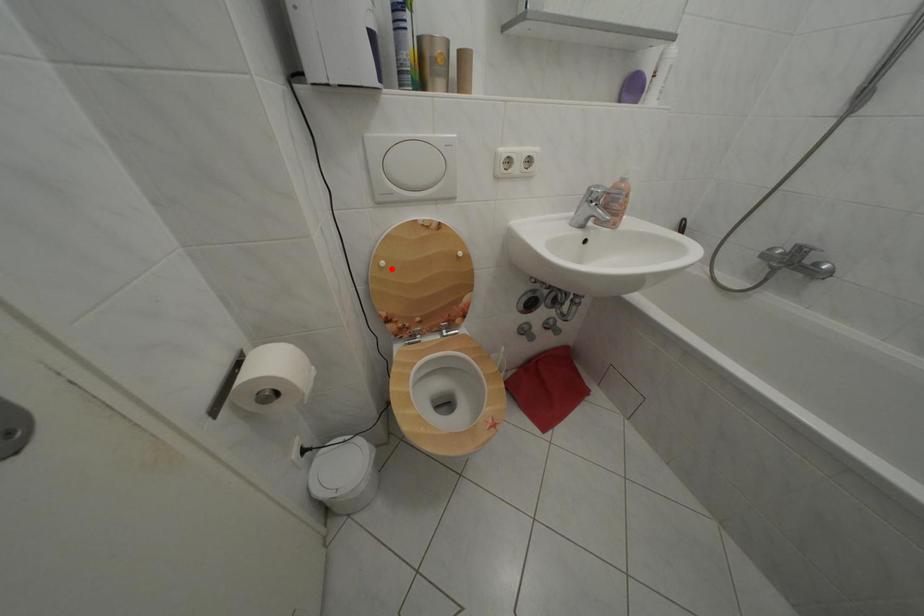
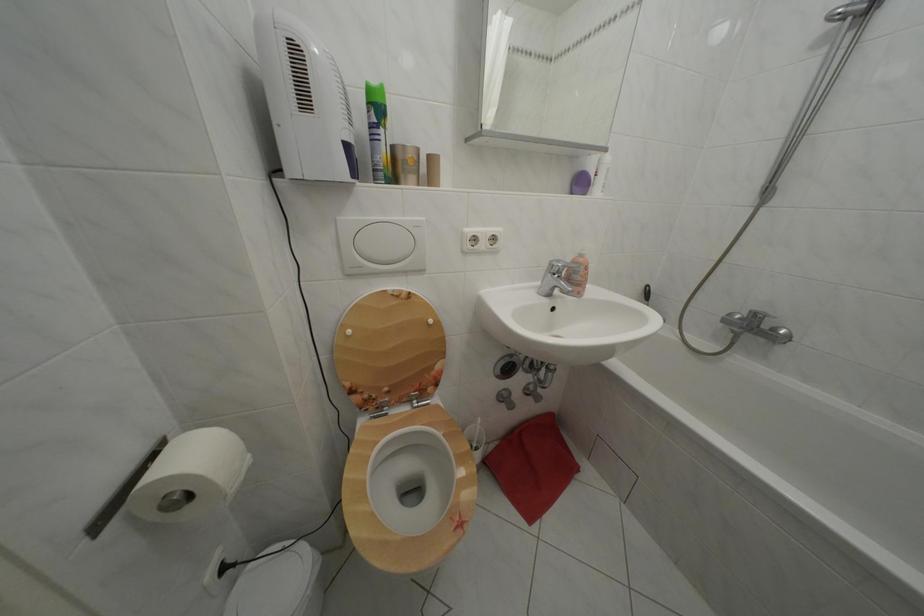
Question: I am providing you with two images of the same scene from different viewpoints. Image1 has a red point marked. In image2, the corresponding 3D location appears at what relative position? Reply with the corresponding letter.

Choices:
 (A) Closer
 (B) Farther

Answer: (B)